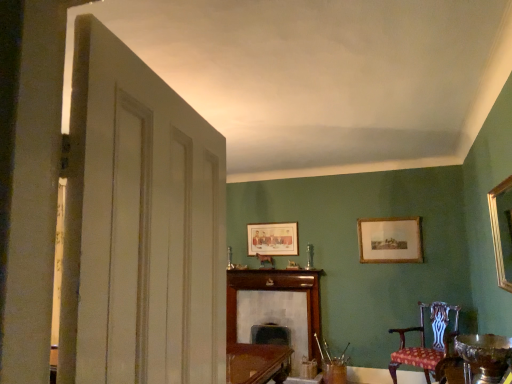
Question: Is gold-framed print at upper right, which is the 2th picture frame from front to back, wider or thinner than shiny silver bowl at lower right?

Choices:
 (A) thin
 (B) wide

Answer: (A)

Question: Is gold-framed print at upper right, which is the 2th picture frame from front to back, to the left or to the right of shiny silver bowl at lower right in the image?

Choices:
 (A) left
 (B) right

Answer: (B)

Question: Estimate the real-world distances between objects in this image. Which object is closer to the wooden fireplace at center?

Choices:
 (A) shiny silver bowl at lower right
 (B) gold-framed print at upper right, the first picture frame from the right
 (C) patterned fabric chair at lower right
 (D) dark brown leather swivel chair at center
 (E) matte wooden picture frame at center, marked as the 1th picture frame in a left-to-right arrangement

Answer: (D)

Question: Estimate the real-world distances between objects in this image. Which object is farther from the white painted wood door at left?

Choices:
 (A) gold-framed print at upper right, which is the 2th picture frame from front to back
 (B) matte wooden picture frame at center, placed as the 3th picture frame when sorted from front to back
 (C) dark brown leather swivel chair at center
 (D) wooden fireplace at center
 (E) shiny silver bowl at lower right

Answer: (B)